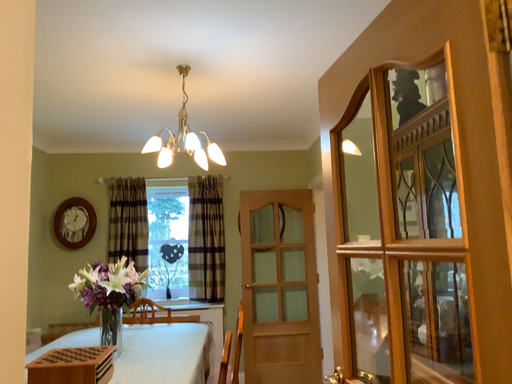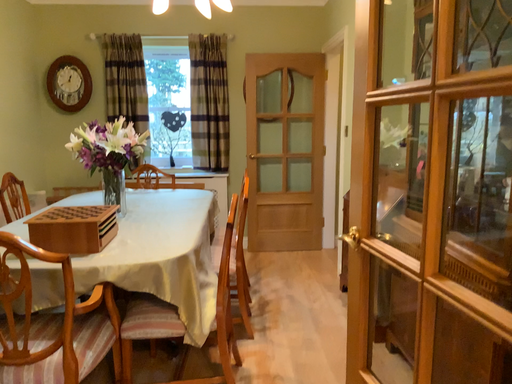
Question: Which way did the camera rotate in the video?

Choices:
 (A) rotated downward
 (B) rotated upward

Answer: (A)